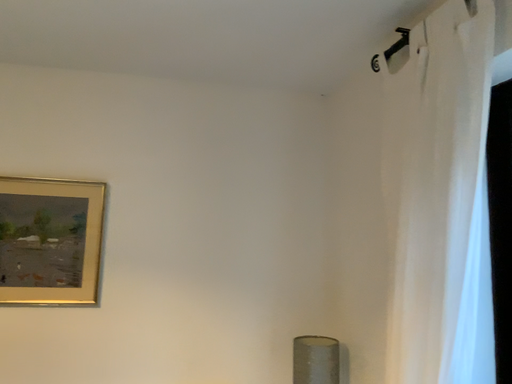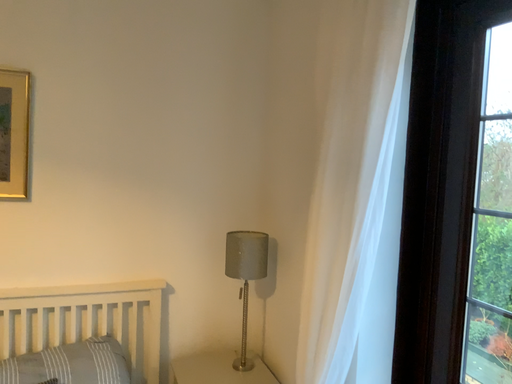
Question: Which way did the camera rotate in the video?

Choices:
 (A) rotated downward
 (B) rotated upward

Answer: (A)